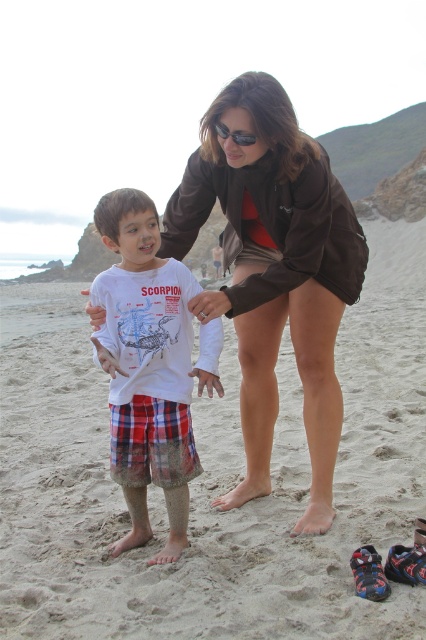
Question: Which of these objects is positioned closest to the black plastic sunglasses at upper center?

Choices:
 (A) sandy beach at center
 (B) white cotton shirt at center
 (C) brown fabric at center

Answer: (C)

Question: Which point is farther to the camera?

Choices:
 (A) (232, 134)
 (B) (213, 138)
 (C) (178, 397)
 (D) (350, 445)

Answer: (D)

Question: Is brown fabric at center to the right of white cotton shirt at center from the viewer's perspective?

Choices:
 (A) no
 (B) yes

Answer: (B)

Question: Does white cotton shirt at center have a larger size compared to black plastic sunglasses at upper center?

Choices:
 (A) yes
 (B) no

Answer: (A)

Question: Among these objects, which one is farthest from the camera?

Choices:
 (A) brown fabric at center
 (B) sandy beach at center

Answer: (A)

Question: Can you confirm if sandy beach at center is thinner than black plastic sunglasses at upper center?

Choices:
 (A) yes
 (B) no

Answer: (B)